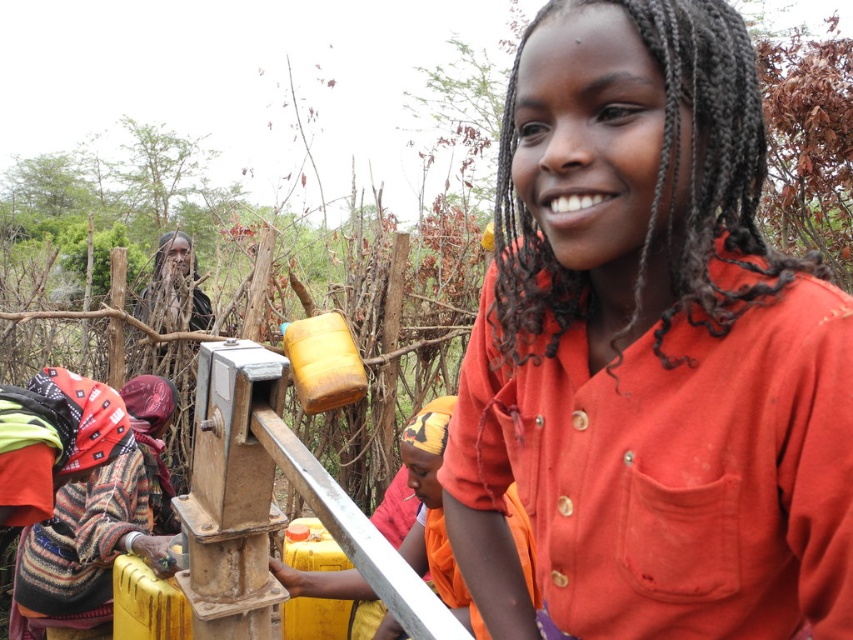
Who is more distant from viewer, [587,454] or [169,394]?

The point [169,394] is more distant.

Is point (581, 572) positioned after point (125, 522)?

No, it is not.

The width and height of the screenshot is (853, 640). What are the coordinates of `orange cotton shirt at center` in the screenshot? It's located at click(x=650, y=349).